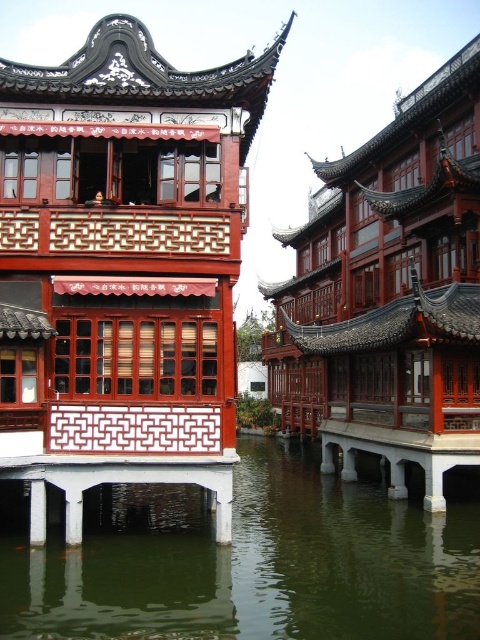
You are an architect analyzing the symmetry of the scene. Based on the height of the matte wood palace at center and the white glossy pillar at lower left, which one contributes more to the vertical balance of the composition?

The matte wood palace at center contributes more to the vertical balance of the composition because it has a greater height compared to the white glossy pillar at lower left.

In the traditional Chinese architectural scene, there are two palaces at the center. The first is a matte wood palace at center and the second is a polished wood palace at center. From the perspective of an observer looking at the image, which palace is positioned to the left?

The matte wood palace at center is positioned to the left of the polished wood palace at center.

You are a tourist standing at the edge of the water in the scene. You want to take a photo of the matte wood palace at center. Considering the distance, can you estimate how far you need to walk to get closer to the palace?

The matte wood palace at center is 34.43 meters away from the camera. Since you are standing at the edge of the water, you need to walk approximately 34.43 meters to reach the palace.